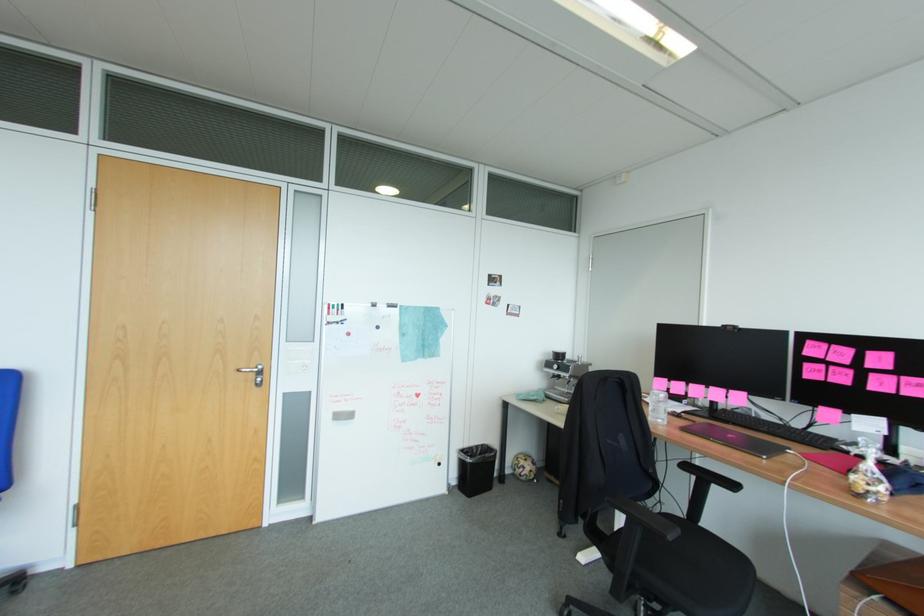
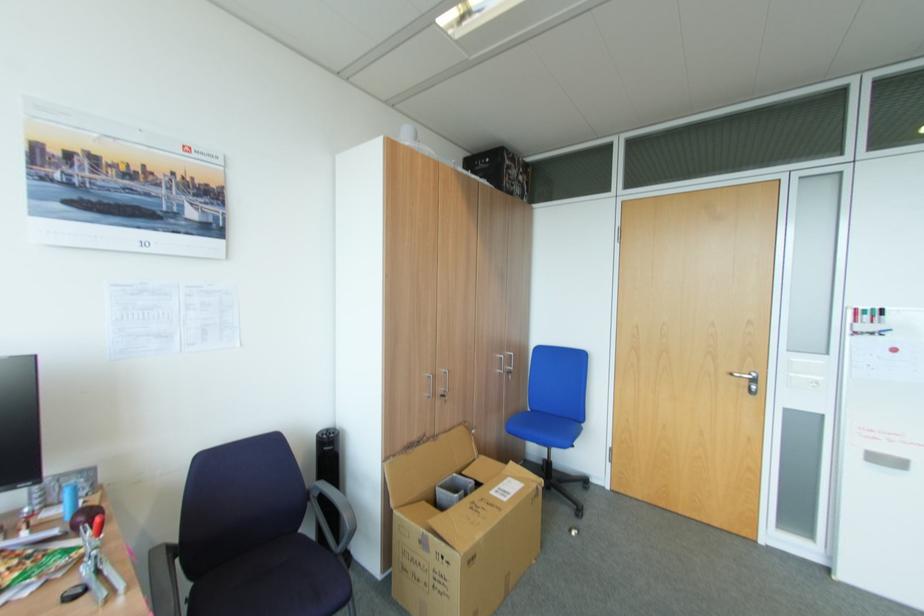
In the second image, find the point that corresponds to (334,314) in the first image.

(861, 322)